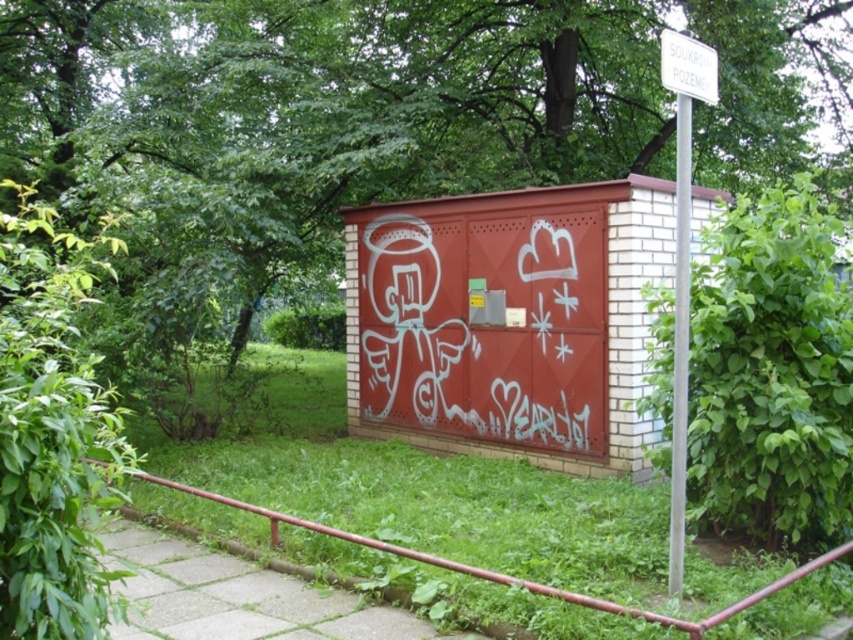
Question: Which object is positioned closest to the green leafy tree at upper center?

Choices:
 (A) red metal rail at lower left
 (B) white plastic sign at upper right

Answer: (A)

Question: Is white graffiti at center bigger than red metal rail at lower left?

Choices:
 (A) yes
 (B) no

Answer: (A)

Question: Considering the real-world distances, which object is closest to the white plastic sign at upper right?

Choices:
 (A) green leafy tree at upper center
 (B) white graffiti at center

Answer: (B)

Question: Is white plastic sign at upper right below red metal rail at lower left?

Choices:
 (A) yes
 (B) no

Answer: (B)

Question: Which object is positioned closest to the white plastic sign at upper right?

Choices:
 (A) green leafy tree at upper center
 (B) red metal rail at lower left

Answer: (B)

Question: Can you confirm if white plastic sign at upper right is positioned to the right of red metal rail at lower left?

Choices:
 (A) yes
 (B) no

Answer: (A)